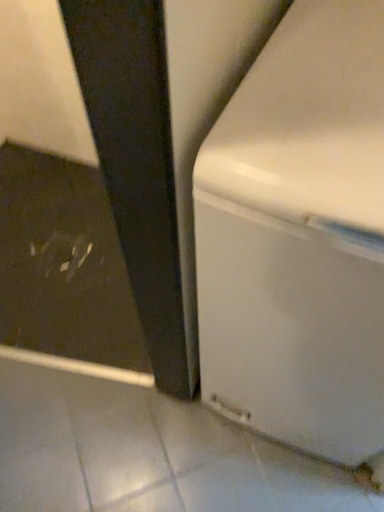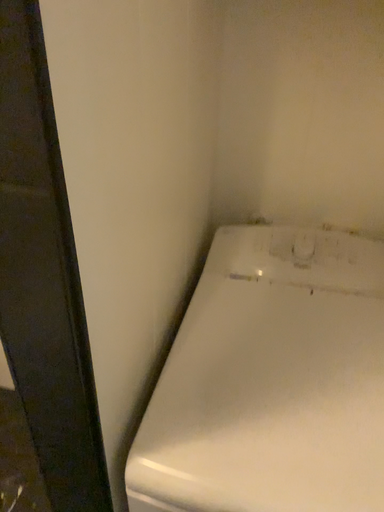
Question: How did the camera likely rotate when shooting the video?

Choices:
 (A) rotated upward
 (B) rotated downward

Answer: (A)